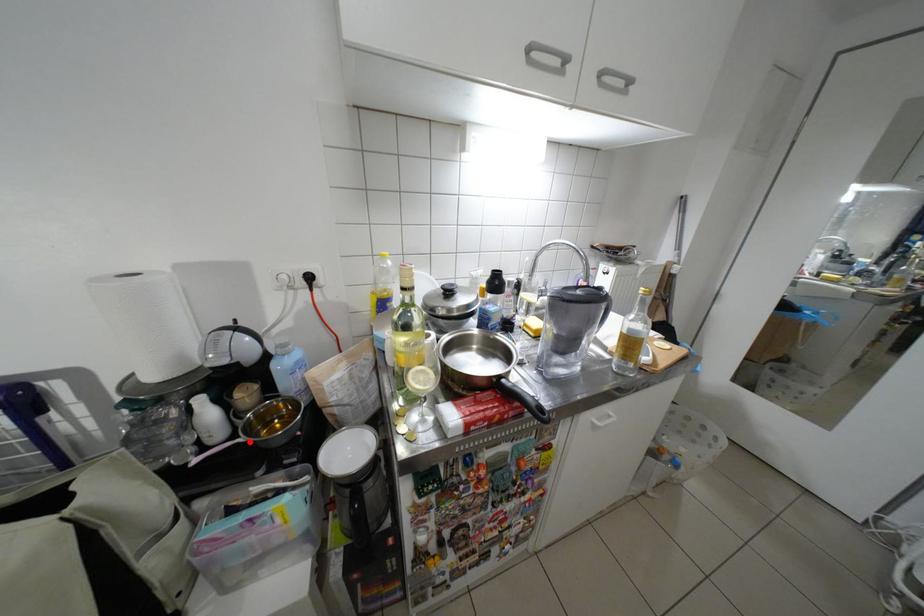
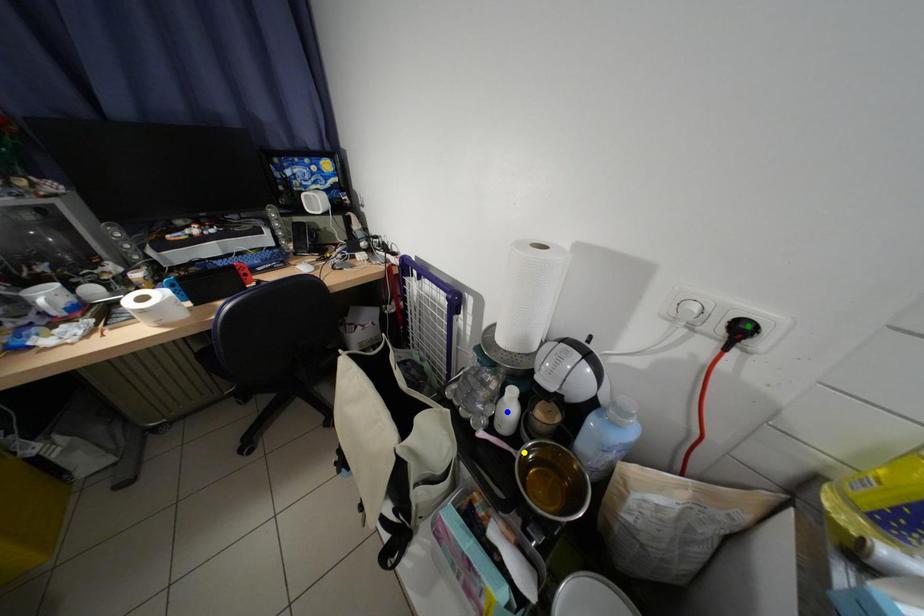
Question: I am providing you with two images of the same scene from different viewpoints. A red point is marked on the first image. You are given multiple points on the second image. Can you choose the point in image 2 that corresponds to the point in image 1?

Choices:
 (A) green point
 (B) yellow point
 (C) blue point

Answer: (B)